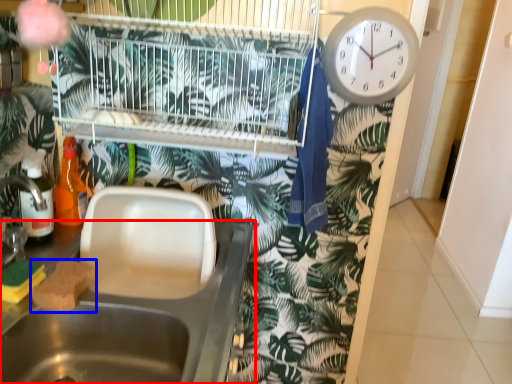
Question: Which point is further to the camera, sink (highlighted by a red box) or food (highlighted by a blue box)?

Choices:
 (A) sink
 (B) food

Answer: (B)